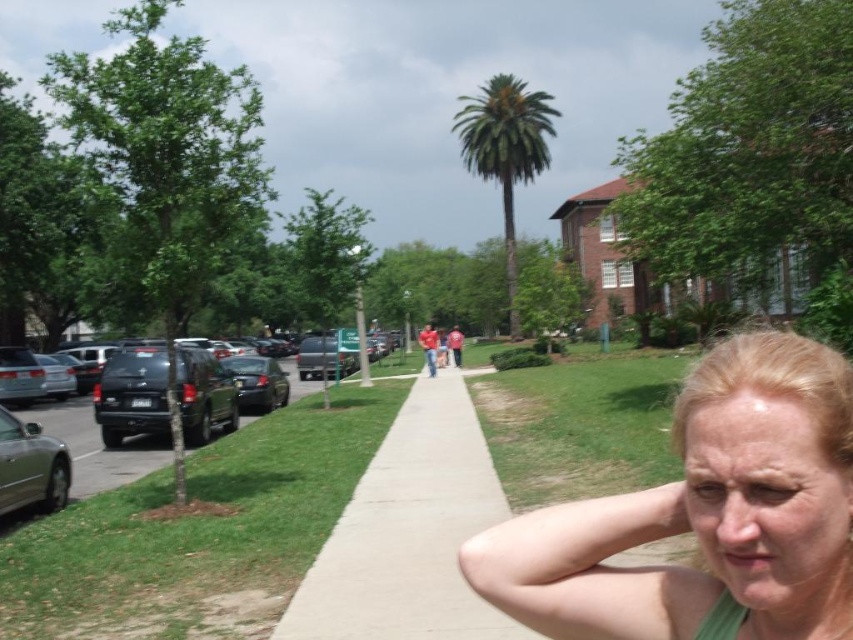
Based on the scene description, where is the green matte tank top at center located in the image?

The green matte tank top at center is located at point coordinates of 0.806 on the x axis and 0.828 on the y axis.

You are a delivery person needing to park your 10 feet long vehicle between the matte black suv at left and the glossy black car at left. Can you fit your vehicle in the space between them?

The space between the matte black suv at left and the glossy black car at left is only 9.89 feet, which is shorter than your 10 feet long vehicle. Therefore, you cannot fit your vehicle in that space.

You are a pedestrian standing on the sidewalk and want to cross the road to reach the grassy area. There is a matte black suv at left and a glossy black car at left parked on the side of the road. Which vehicle should you walk around to get to the grassy area?

The matte black suv at left is in front of the glossy black car at left, so you should walk around the matte black suv at left to reach the grassy area.